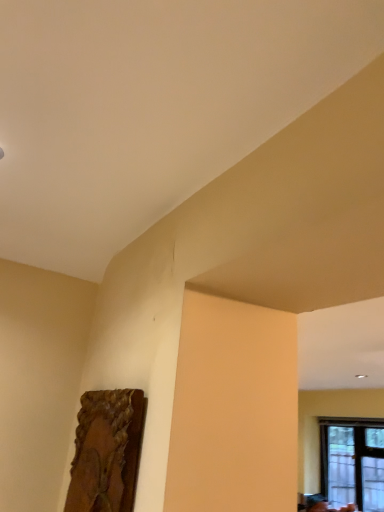
Question: Should I look upward or downward to see transparent glass window at lower right?

Choices:
 (A) down
 (B) up

Answer: (A)

Question: Considering the relative sizes of transparent glass window at lower right and wooden frame at lower left in the image provided, is transparent glass window at lower right taller than wooden frame at lower left?

Choices:
 (A) yes
 (B) no

Answer: (A)

Question: Does transparent glass window at lower right have a greater width compared to wooden frame at lower left?

Choices:
 (A) yes
 (B) no

Answer: (A)

Question: Considering the relative sizes of transparent glass window at lower right and wooden frame at lower left in the image provided, is transparent glass window at lower right thinner than wooden frame at lower left?

Choices:
 (A) no
 (B) yes

Answer: (A)

Question: From the image's perspective, is transparent glass window at lower right below wooden frame at lower left?

Choices:
 (A) yes
 (B) no

Answer: (A)

Question: Is wooden frame at lower left surrounded by transparent glass window at lower right?

Choices:
 (A) no
 (B) yes

Answer: (A)

Question: From a real-world perspective, is transparent glass window at lower right located beneath wooden frame at lower left?

Choices:
 (A) yes
 (B) no

Answer: (A)

Question: Considering the relative sizes of wooden frame at lower left and transparent glass window at lower right in the image provided, is wooden frame at lower left wider than transparent glass window at lower right?

Choices:
 (A) yes
 (B) no

Answer: (B)

Question: Considering the relative positions of wooden frame at lower left and transparent glass window at lower right in the image provided, is wooden frame at lower left to the right of transparent glass window at lower right from the viewer's perspective?

Choices:
 (A) no
 (B) yes

Answer: (A)

Question: From a real-world perspective, is wooden frame at lower left physically below transparent glass window at lower right?

Choices:
 (A) yes
 (B) no

Answer: (B)

Question: Is wooden frame at lower left smaller than transparent glass window at lower right?

Choices:
 (A) yes
 (B) no

Answer: (A)

Question: Considering the relative sizes of wooden frame at lower left and transparent glass window at lower right in the image provided, is wooden frame at lower left taller than transparent glass window at lower right?

Choices:
 (A) yes
 (B) no

Answer: (B)

Question: Can you confirm if wooden frame at lower left is positioned to the left of transparent glass window at lower right?

Choices:
 (A) yes
 (B) no

Answer: (A)

Question: Which is correct: transparent glass window at lower right is inside wooden frame at lower left, or outside of it?

Choices:
 (A) outside
 (B) inside

Answer: (A)